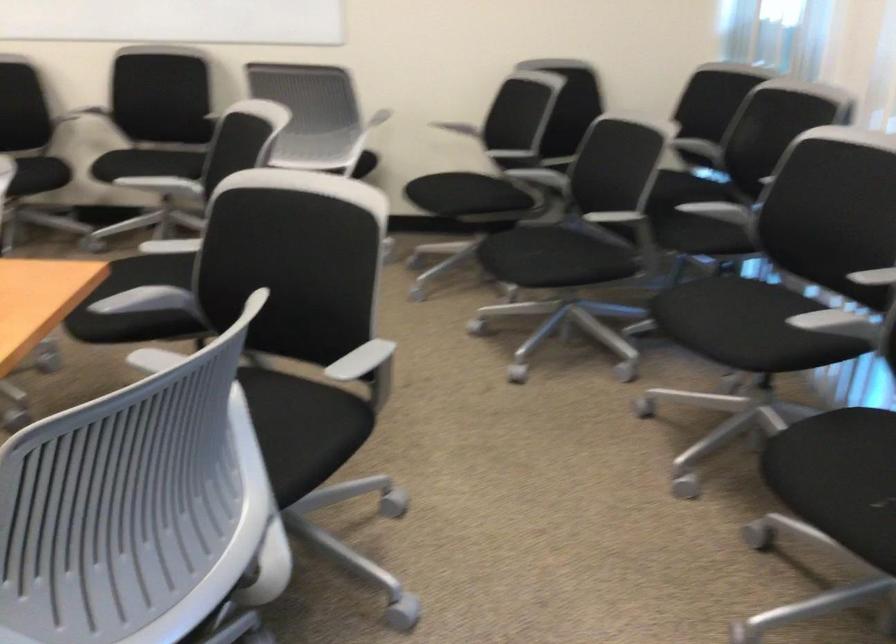
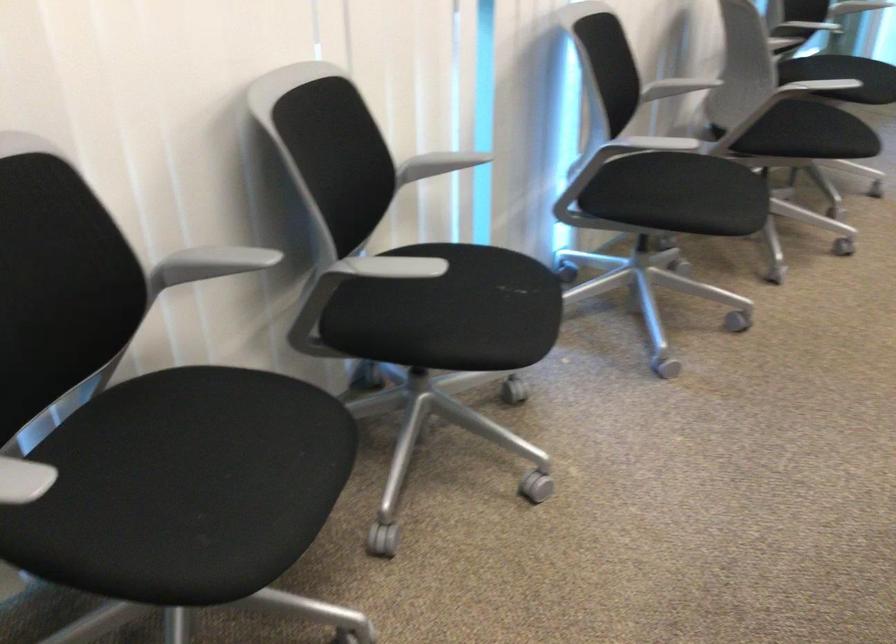
In the second image, find the point that corresponds to the point at 811,322 in the first image.

(384, 267)